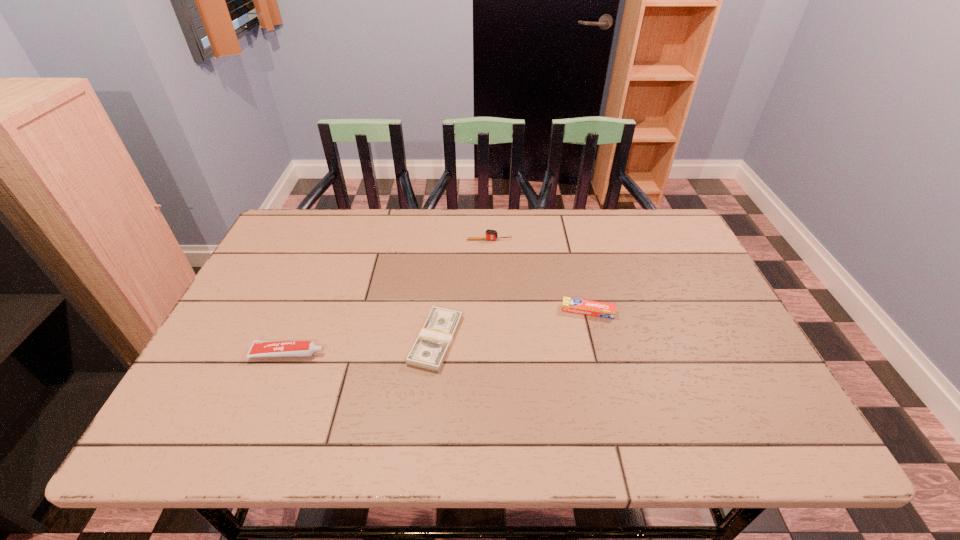
Identify the location of the third object from left to right. This screenshot has width=960, height=540. (490, 234).

Find the location of a particular element. the farthest object is located at coordinates (490, 234).

Identify the location of the taller toothpaste. (259, 348).

This screenshot has width=960, height=540. I want to click on the left toothpaste, so click(x=259, y=348).

The height and width of the screenshot is (540, 960). I want to click on the rightmost object, so click(x=573, y=305).

You are a GUI agent. You are given a task and a screenshot of the screen. Output one action in this format:
    pyautogui.click(x=<x>, y=<y>)
    Task: Click on the farther toothpaste
    The height and width of the screenshot is (540, 960).
    Given the screenshot: What is the action you would take?
    pyautogui.click(x=573, y=305)

The image size is (960, 540). I want to click on the shortest object, so click(429, 351).

At what (x,y) coordinates should I click in order to perform the action: click on the third object from right to left. Please return your answer as a coordinate pair (x, y). Looking at the image, I should click on (429, 351).

Find the location of a particular element. This screenshot has width=960, height=540. vacant space located on the left of the third object from left to right is located at coordinates pos(419,240).

The image size is (960, 540). In order to click on blank space located 0.170m at the nozzle of the taller toothpaste in this screenshot , I will do `click(397, 354)`.